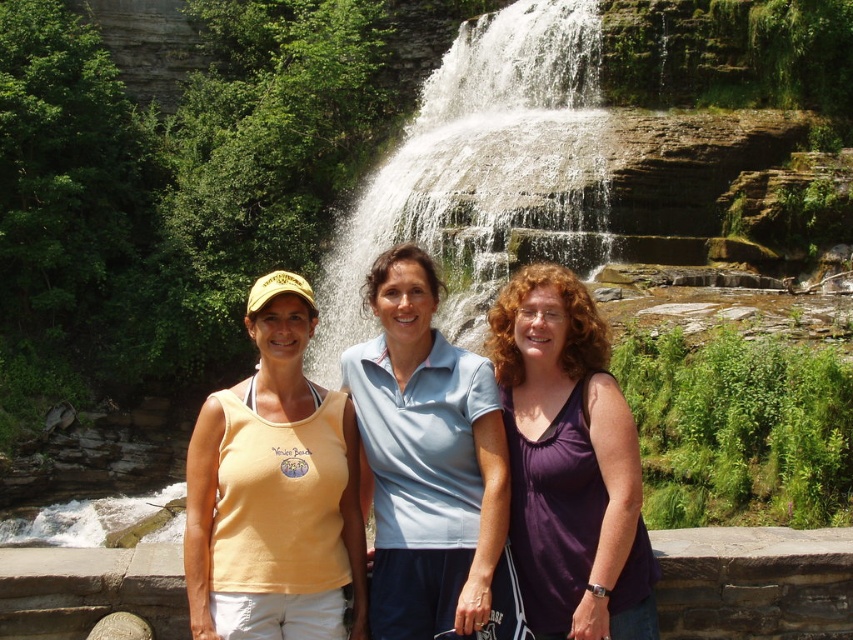
You are standing in front of the waterfall and want to take a photo of the white textured water at center. Where should you point your camera to capture it?

The white textured water at center is located at point (x=479, y=170), so you should point your camera towards those coordinates to capture it.

You are a photographer trying to capture a photo of the waterfall and the people. You need to ensure the white textured water at center and the purple matte tank top at center are both visible in the frame. Which object should you adjust your camera to focus on first to ensure both are in the shot?

The white textured water at center is positioned on the left side of purple matte tank top at center. To ensure both are in the shot, focus on the purple matte tank top at center first since it is on the right and adjust the frame to include the left side where the water is located.